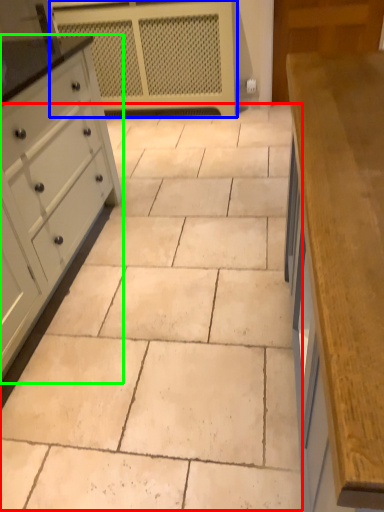
Question: Estimate the real-world distances between objects in this image. Which object is closer to ceramic tile (highlighted by a red box), appliance (highlighted by a blue box) or chest of drawers (highlighted by a green box)?

Choices:
 (A) appliance
 (B) chest of drawers

Answer: (B)